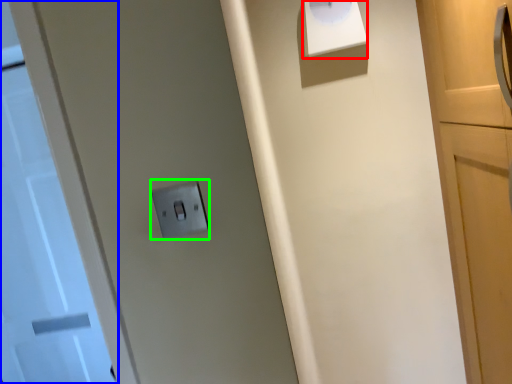
Question: Considering the real-world distances, which object is closest to wide (highlighted by a red box)? door (highlighted by a blue box) or light switch (highlighted by a green box).

Choices:
 (A) door
 (B) light switch

Answer: (B)